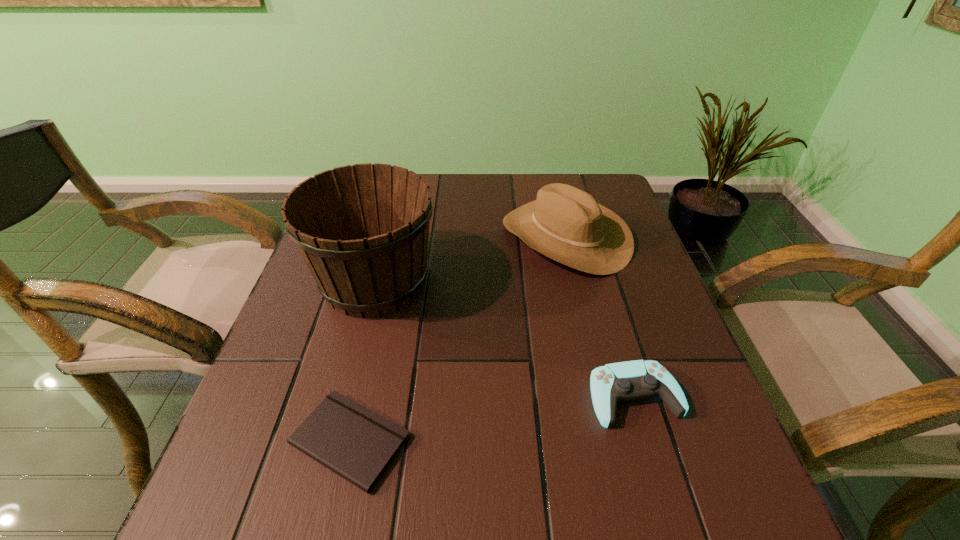
Where is `blank space at the far right corner of the desktop`? This screenshot has height=540, width=960. blank space at the far right corner of the desktop is located at coordinates (602, 193).

I want to click on vacant point located between the tallest object and the control, so click(x=505, y=339).

Where is `free space between the wine bucket and the checkbook`? This screenshot has width=960, height=540. free space between the wine bucket and the checkbook is located at coordinates (362, 361).

Identify the location of unoccupied position between the second shortest object and the checkbook. (492, 419).

Identify the location of vacant area between the third tallest object and the tallest object. (505, 339).

Identify the location of free spot between the tallest object and the second tallest object. The width and height of the screenshot is (960, 540). click(x=470, y=259).

You are a GUI agent. You are given a task and a screenshot of the screen. Output one action in this format:
    pyautogui.click(x=<x>, y=<y>)
    Task: Click on the empty location between the second tallest object and the wine bucket
    Image resolution: width=960 pixels, height=540 pixels.
    Given the screenshot: What is the action you would take?
    pyautogui.click(x=470, y=259)

At what (x,y) coordinates should I click in order to perform the action: click on vacant area that lies between the third tallest object and the third shortest object. Please return your answer as a coordinate pair (x, y). Looking at the image, I should click on click(x=600, y=316).

Identify the location of object that stands as the third closest to the wine bucket. (624, 381).

Where is `the second closest object to the tallest object`? the second closest object to the tallest object is located at coordinates (351, 440).